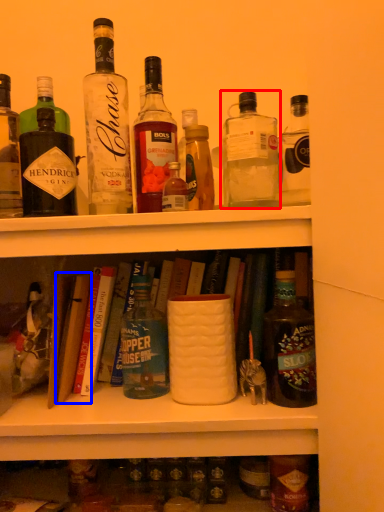
Question: Which object is closer to the camera taking this photo, bottle (highlighted by a red box) or book (highlighted by a blue box)?

Choices:
 (A) bottle
 (B) book

Answer: (A)